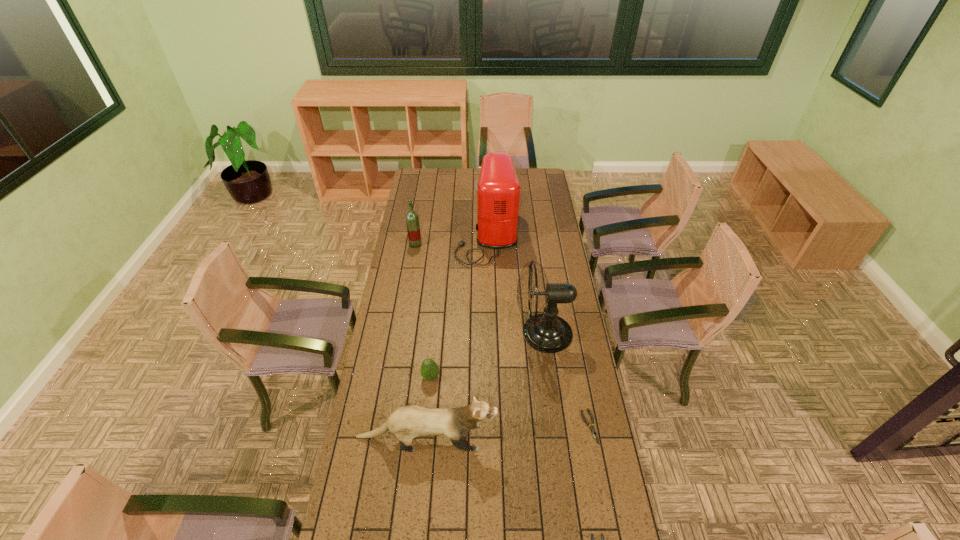
This screenshot has width=960, height=540. Identify the location of free space located 0.290m on the front-facing side of the kitchen mixer. (403, 235).

Identify the location of free space located on the front-facing side of the fan. (493, 333).

Locate an element on the screen. free spot located 0.080m on the front-facing side of the fan is located at coordinates (495, 333).

Identify the location of vacant space located 0.330m on the front-facing side of the fan. (439, 333).

Locate an element on the screen. The height and width of the screenshot is (540, 960). free region located 0.310m on the front of the fifth shortest object is located at coordinates (408, 290).

In order to click on blank area located on the face of the ferret in this screenshot , I will do 600,437.

Find the location of a particular element. vacant area situated on the back of the fourth nearest object is located at coordinates (435, 329).

Find the location of a particular element. This screenshot has width=960, height=540. vacant region located on the left of the shorter pliers is located at coordinates (507, 427).

Image resolution: width=960 pixels, height=540 pixels. Find the location of `liquor that is at the left edge`. liquor that is at the left edge is located at coordinates (412, 220).

Find the location of `ferret present at the left edge`. ferret present at the left edge is located at coordinates (407, 422).